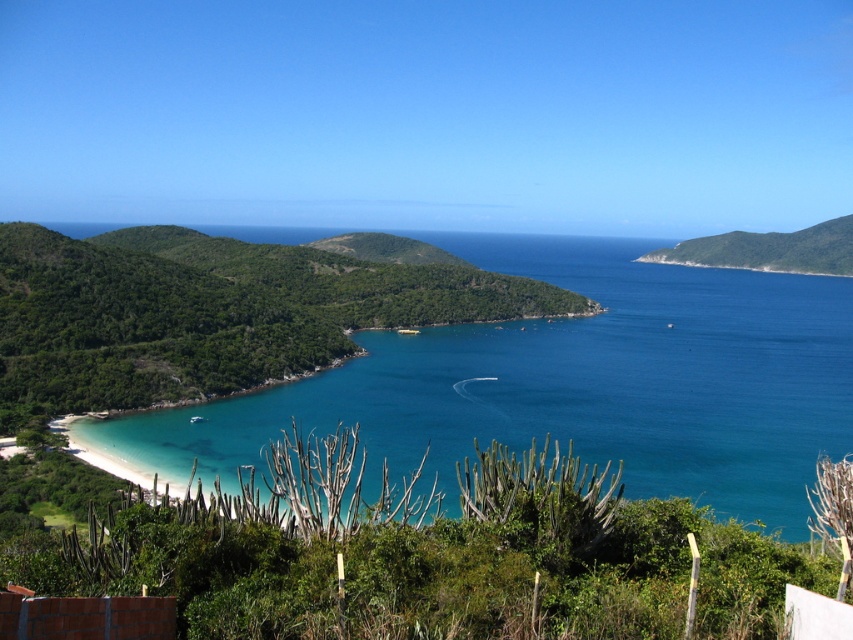
Consider the image. You are a marine biologist planning to place a buoy in the clear blue water at lower left and a weather station on the green leafy hill at lower left. Given that the buoy and weather station need to be at least 80 meters apart for optimal signal transmission, will their current positions meet this requirement?

The clear blue water at lower left and green leafy hill at lower left are 78.32 meters apart from each other. Since 78.32 meters is less than the required 80 meters, their current positions do not meet the signal transmission requirement.

You are standing on the sandy beach and see the green leafy hill at lower left and the green leafy hill at upper right. Which hill is positioned more to the left side of the scene?

The green leafy hill at lower left is positioned more to the left side of the scene compared to the green leafy hill at upper right.

You are standing at the center of the coastal landscape and want to walk to the closest object between the clear blue water at lower left and the green leafy hill at upper right. Which one should you head towards?

The clear blue water at lower left is closer to you since it is only 188.85 meters away from the green leafy hill at upper right, so you should head towards the clear blue water at lower left.